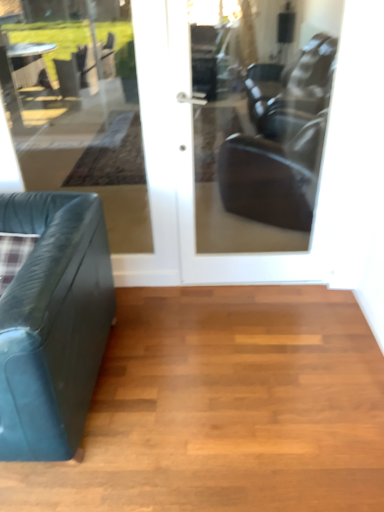
Question: From the image's perspective, is shiny brown hardwood floor at lower left beneath matte glass door at center?

Choices:
 (A) yes
 (B) no

Answer: (A)

Question: Can you confirm if shiny brown hardwood floor at lower left is positioned to the left of matte glass door at center?

Choices:
 (A) no
 (B) yes

Answer: (B)

Question: Is shiny brown hardwood floor at lower left outside of matte glass door at center?

Choices:
 (A) yes
 (B) no

Answer: (A)

Question: Considering the relative sizes of shiny brown hardwood floor at lower left and matte glass door at center in the image provided, is shiny brown hardwood floor at lower left smaller than matte glass door at center?

Choices:
 (A) no
 (B) yes

Answer: (B)

Question: Is shiny brown hardwood floor at lower left touching matte glass door at center?

Choices:
 (A) no
 (B) yes

Answer: (A)

Question: From a real-world perspective, is shiny brown hardwood floor at lower left below matte glass door at center?

Choices:
 (A) yes
 (B) no

Answer: (A)

Question: From the image's perspective, is teal leather studio couch at left on matte glass door at center?

Choices:
 (A) no
 (B) yes

Answer: (A)

Question: From a real-world perspective, is teal leather studio couch at left positioned under matte glass door at center based on gravity?

Choices:
 (A) yes
 (B) no

Answer: (A)

Question: Is teal leather studio couch at left shorter than matte glass door at center?

Choices:
 (A) yes
 (B) no

Answer: (A)

Question: Are teal leather studio couch at left and matte glass door at center beside each other?

Choices:
 (A) yes
 (B) no

Answer: (B)

Question: Can you confirm if teal leather studio couch at left is wider than matte glass door at center?

Choices:
 (A) no
 (B) yes

Answer: (B)

Question: From the image's perspective, is teal leather studio couch at left below matte glass door at center?

Choices:
 (A) no
 (B) yes

Answer: (B)

Question: Is matte glass door at center positioned with its back to teal leather studio couch at left?

Choices:
 (A) no
 (B) yes

Answer: (A)